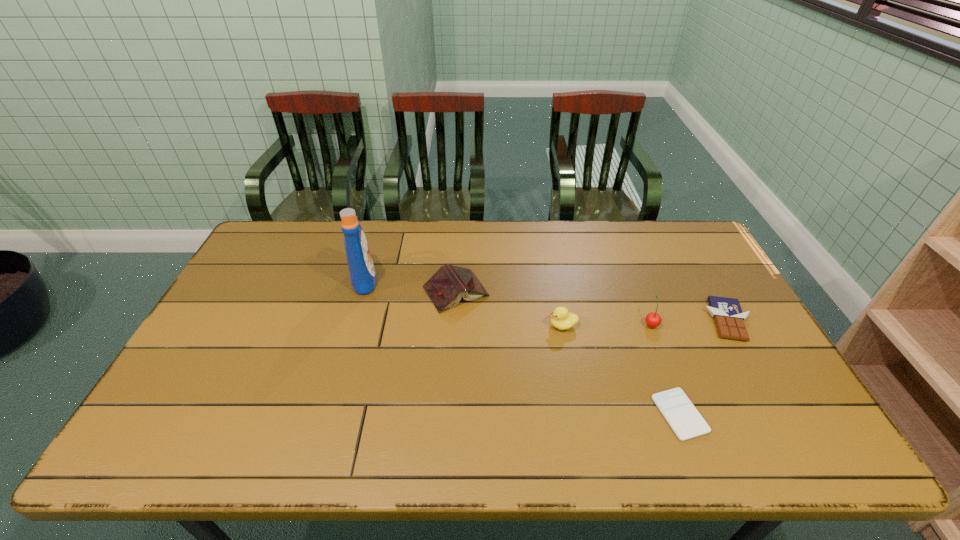
You are a GUI agent. You are given a task and a screenshot of the screen. Output one action in this format:
    pyautogui.click(x=<x>, y=<y>)
    Task: Click on the tallest object
    
    Given the screenshot: What is the action you would take?
    pyautogui.click(x=361, y=268)

What are the coordinates of `the leftmost object` in the screenshot? It's located at (361, 268).

The width and height of the screenshot is (960, 540). In order to click on the fifth shortest object in this screenshot , I will do `click(653, 320)`.

What are the coordinates of `duckling` in the screenshot? It's located at (561, 318).

Identify the location of the third shortest object. Image resolution: width=960 pixels, height=540 pixels. (450, 283).

Where is `the second object from left to right`? Image resolution: width=960 pixels, height=540 pixels. the second object from left to right is located at coordinates click(x=450, y=283).

This screenshot has width=960, height=540. Find the location of `chocolate bar`. chocolate bar is located at coordinates (727, 313).

The width and height of the screenshot is (960, 540). I want to click on the rightmost object, so click(727, 313).

In order to click on calculator in this screenshot , I will do `click(682, 416)`.

Locate an element on the screen. the nearest object is located at coordinates (682, 416).